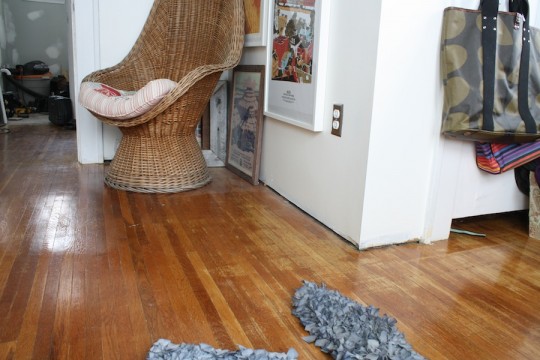
Locate an element on the screen. white reflection from ceiling light is located at coordinates (57, 217).